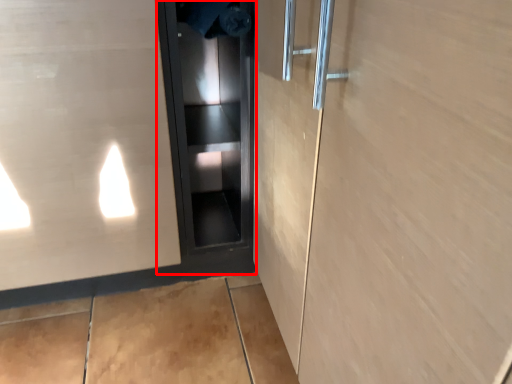
Question: In this image, where is elevator door (annotated by the red box) located relative to elevator door?

Choices:
 (A) right
 (B) left

Answer: (A)